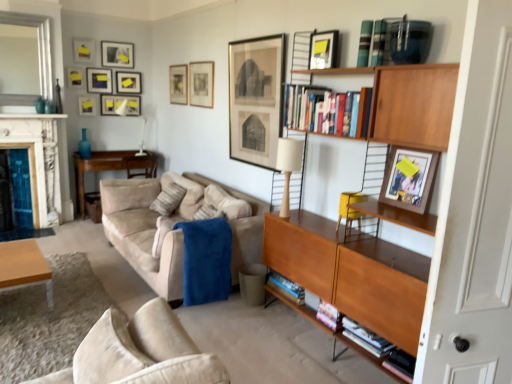
Question: From a real-world perspective, does matte black picture frame at upper center, which is the 8th picture frame in left-to-right order, stand above matte black picture frame at upper center, placed as the 2th picture frame when sorted from right to left?

Choices:
 (A) yes
 (B) no

Answer: (B)

Question: Considering the relative sizes of matte black picture frame at upper center, which appears as the fifth picture frame when viewed from the front, and matte black picture frame at upper center, arranged as the 11th picture frame when viewed from the back, in the image provided, is matte black picture frame at upper center, which appears as the fifth picture frame when viewed from the front, thinner than matte black picture frame at upper center, arranged as the 11th picture frame when viewed from the back,?

Choices:
 (A) yes
 (B) no

Answer: (A)

Question: Is matte black picture frame at upper center, arranged as the eleventh picture frame when viewed from the left, located within matte black picture frame at upper center, which appears as the fifth picture frame when viewed from the right?

Choices:
 (A) yes
 (B) no

Answer: (B)

Question: Considering the relative sizes of matte black picture frame at upper center, which is the 8th picture frame in left-to-right order, and matte black picture frame at upper center, arranged as the 11th picture frame when viewed from the back, in the image provided, is matte black picture frame at upper center, which is the 8th picture frame in left-to-right order, taller than matte black picture frame at upper center, arranged as the 11th picture frame when viewed from the back,?

Choices:
 (A) no
 (B) yes

Answer: (B)

Question: From a real-world perspective, is matte black picture frame at upper center, which appears as the fifth picture frame when viewed from the right, physically below matte black picture frame at upper center, arranged as the 11th picture frame when viewed from the back?

Choices:
 (A) yes
 (B) no

Answer: (A)

Question: Is point (99, 77) closer or farther from the camera than point (361, 34)?

Choices:
 (A) closer
 (B) farther

Answer: (B)

Question: In terms of height, does matte black picture frame at upper left, which ranks as the 9th picture frame in right-to-left order, look taller or shorter compared to blue hardcover book at upper right, the 2th book viewed from the right?

Choices:
 (A) short
 (B) tall

Answer: (B)

Question: Do you think matte black picture frame at upper left, which is the 9th picture frame from front to back, is within blue hardcover book at upper right, the 2th book viewed from the right, or outside of it?

Choices:
 (A) outside
 (B) inside

Answer: (A)

Question: Considering their positions, is matte black picture frame at upper left, which ranks as the 9th picture frame in right-to-left order, located in front of or behind blue hardcover book at upper right, the 2th book viewed from the right?

Choices:
 (A) front
 (B) behind

Answer: (B)

Question: In the image, is blue plush blanket at center on the left side or the right side of matte black picture frame at upper center, which is the 8th picture frame in left-to-right order?

Choices:
 (A) left
 (B) right

Answer: (B)

Question: Is blue plush blanket at center wider or thinner than matte black picture frame at upper center, which appears as the fifth picture frame when viewed from the right?

Choices:
 (A) thin
 (B) wide

Answer: (B)

Question: From a real-world perspective, is blue plush blanket at center positioned above or below matte black picture frame at upper center, which is the 8th picture frame in left-to-right order?

Choices:
 (A) above
 (B) below

Answer: (B)

Question: Is point (222, 296) closer or farther from the camera than point (170, 69)?

Choices:
 (A) farther
 (B) closer

Answer: (B)

Question: From a real-world perspective, is matte black picture frame at upper center, the seventh picture frame from the left, physically located above or below marble fireplace at left?

Choices:
 (A) above
 (B) below

Answer: (A)

Question: Does point (120, 82) appear closer or farther from the camera than point (19, 114)?

Choices:
 (A) farther
 (B) closer

Answer: (A)